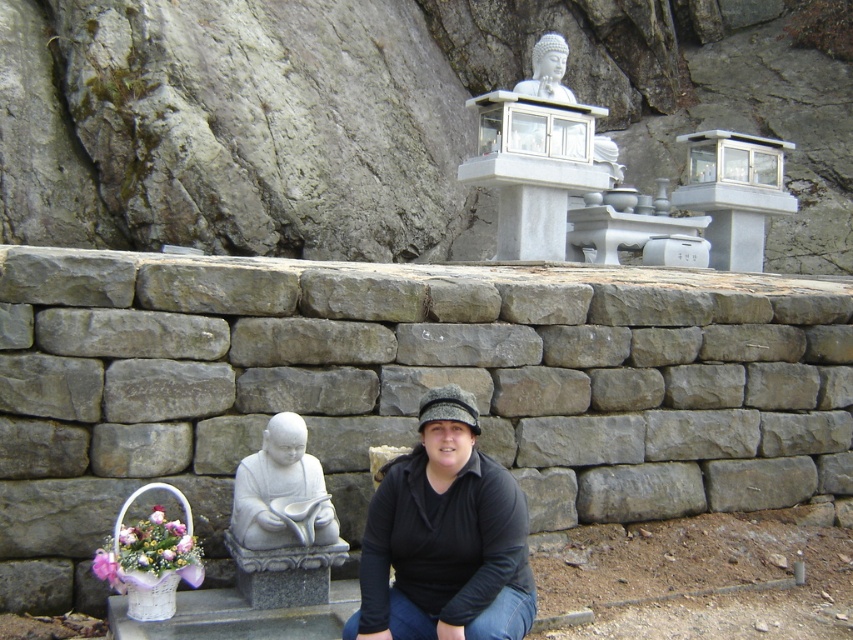
Does black fabric squat at center have a greater width compared to white stone statue at lower left?

Indeed, black fabric squat at center has a greater width compared to white stone statue at lower left.

Can you confirm if black fabric squat at center is taller than white stone statue at lower left?

Yes.

Between point (410, 458) and point (322, 497), which one is positioned in front?

Point (410, 458)

This screenshot has width=853, height=640. In order to click on black fabric squat at center in this screenshot , I will do `click(444, 538)`.

Does white stone statue at lower left lie in front of white stone statue at upper center?

Yes.

Does white stone statue at lower left have a lesser width compared to white stone statue at upper center?

Indeed, white stone statue at lower left has a lesser width compared to white stone statue at upper center.

The image size is (853, 640). What are the coordinates of `white stone statue at lower left` in the screenshot? It's located at (281, 492).

Who is lower down, black fabric squat at center or white stone statue at upper center?

black fabric squat at center is below.

Is black fabric squat at center closer to camera compared to white stone statue at upper center?

Yes, it is.

Where is `black fabric squat at center`? The image size is (853, 640). black fabric squat at center is located at coordinates (444, 538).